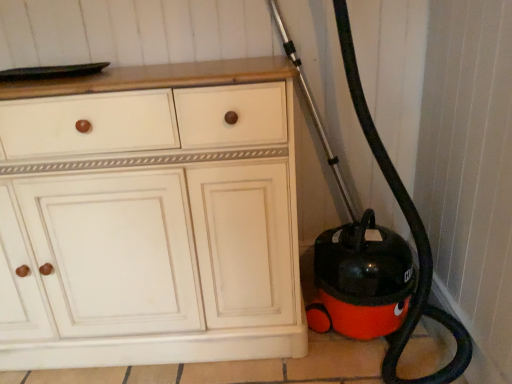
Question: Do you think white wood cabinet at center is within black rubber garden hose at right, or outside of it?

Choices:
 (A) inside
 (B) outside

Answer: (B)

Question: Looking at their shapes, would you say white wood cabinet at center is wider or thinner than black rubber garden hose at right?

Choices:
 (A) thin
 (B) wide

Answer: (A)

Question: From a real-world perspective, is white wood cabinet at center positioned above or below black rubber garden hose at right?

Choices:
 (A) above
 (B) below

Answer: (B)

Question: Considering the positions of black rubber garden hose at right and white wood cabinet at center in the image, is black rubber garden hose at right bigger or smaller than white wood cabinet at center?

Choices:
 (A) small
 (B) big

Answer: (A)

Question: Considering their positions, is black rubber garden hose at right located in front of or behind white wood cabinet at center?

Choices:
 (A) front
 (B) behind

Answer: (A)

Question: Looking at their shapes, would you say black rubber garden hose at right is wider or thinner than white wood cabinet at center?

Choices:
 (A) thin
 (B) wide

Answer: (B)

Question: From their relative heights in the image, would you say black rubber garden hose at right is taller or shorter than white wood cabinet at center?

Choices:
 (A) short
 (B) tall

Answer: (B)